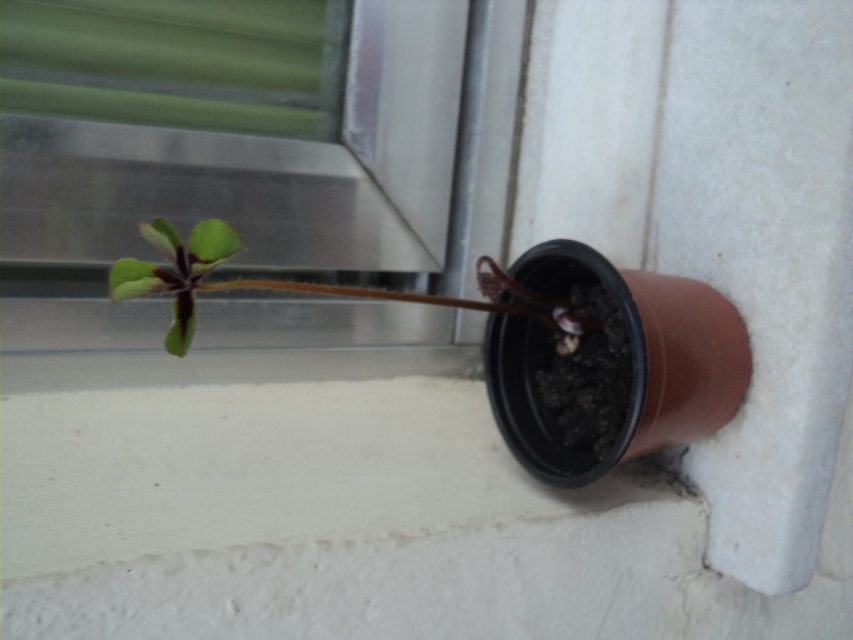
You are standing in a room and see the green matte window at upper left and the green matte leaf at center. Which object is located more to the left?

The green matte window at upper left is more to the left than the green matte leaf at center.

You are standing in front of the potted plant on the white concrete ledge. There are two points marked in the image. The first point is at coordinates point [260,312] and the second point is at point [126,259]. Which point is closer to you?

Point [126,259] is closer to you because it is in front of point [260,312].